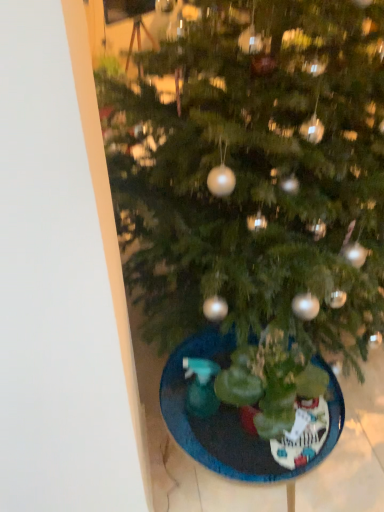
At what (x,y) coordinates should I click in order to perform the action: click on free space to the left of green matte plant at center. Please return your answer as a coordinate pair (x, y). Image resolution: width=384 pixels, height=512 pixels. Looking at the image, I should click on (183, 415).